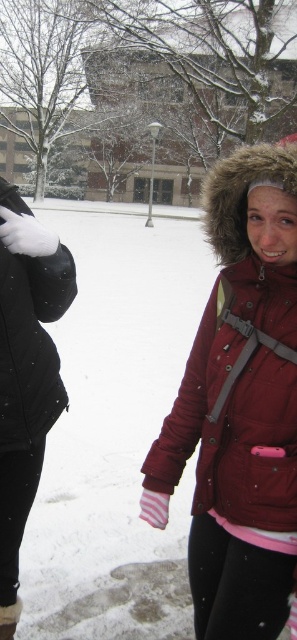
Is matte red jacket at right bigger than black matte jacket at left?

Actually, matte red jacket at right might be smaller than black matte jacket at left.

What do you see at coordinates (239, 404) in the screenshot? I see `matte red jacket at right` at bounding box center [239, 404].

Identify the location of matte red jacket at right. This screenshot has width=297, height=640. (239, 404).